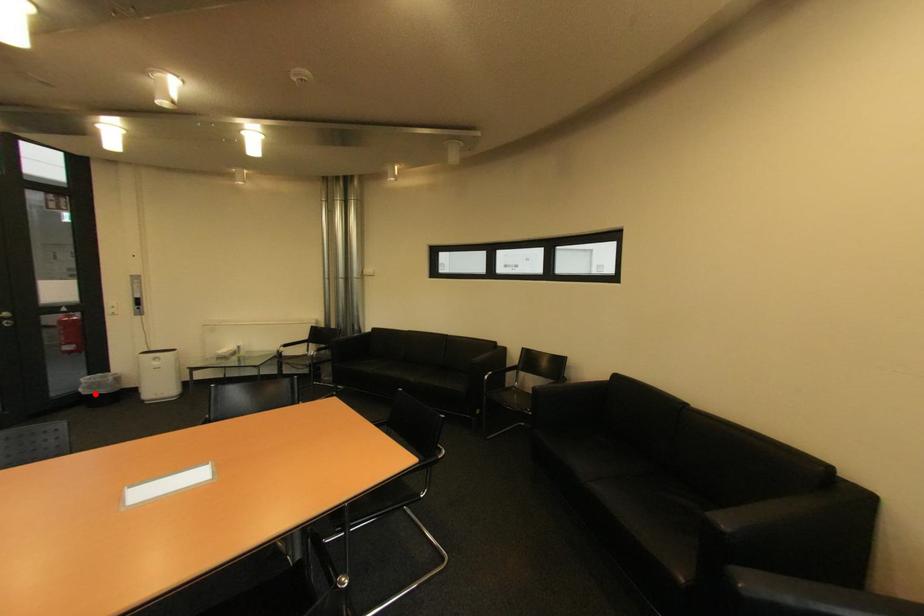
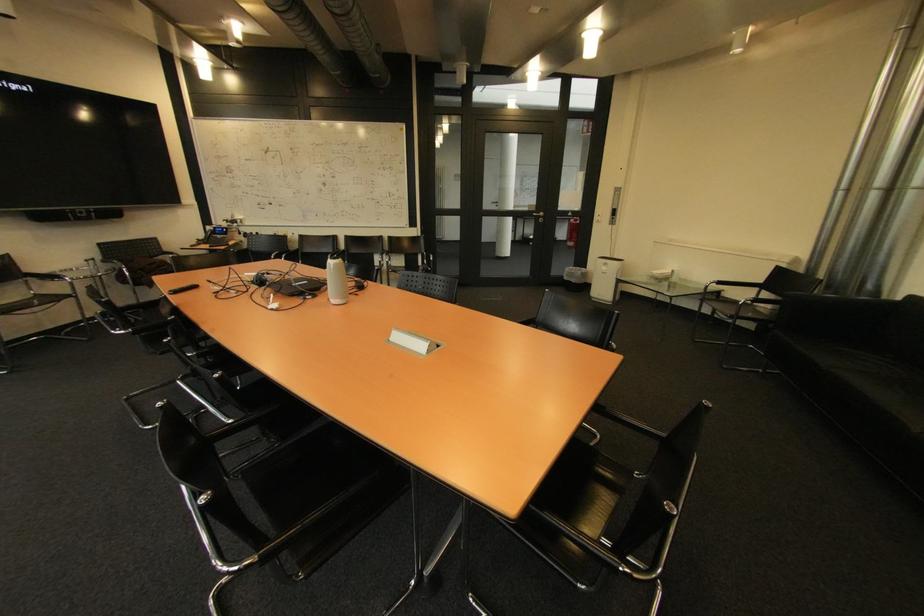
Find the pixel in the second image that matches the highlighted location in the first image.

(574, 280)